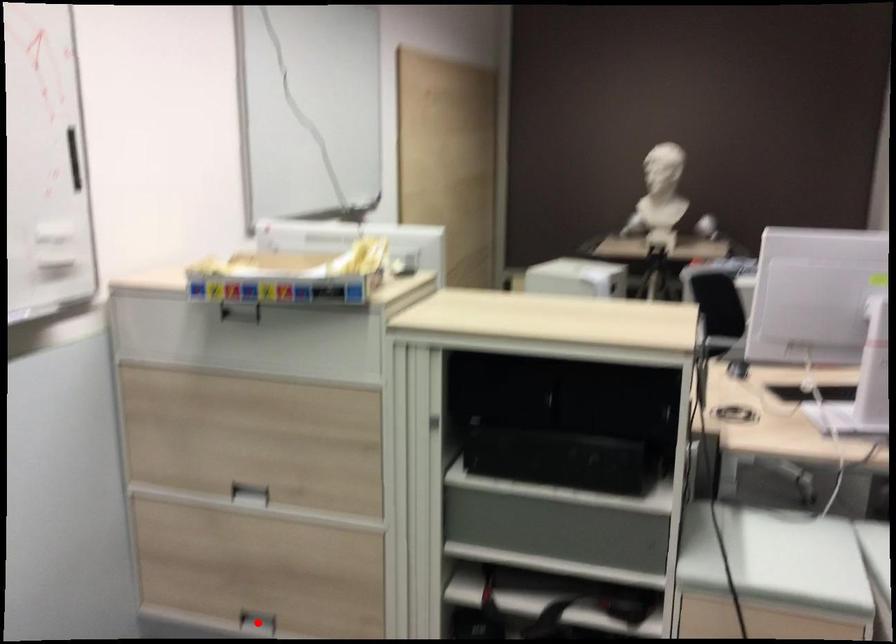
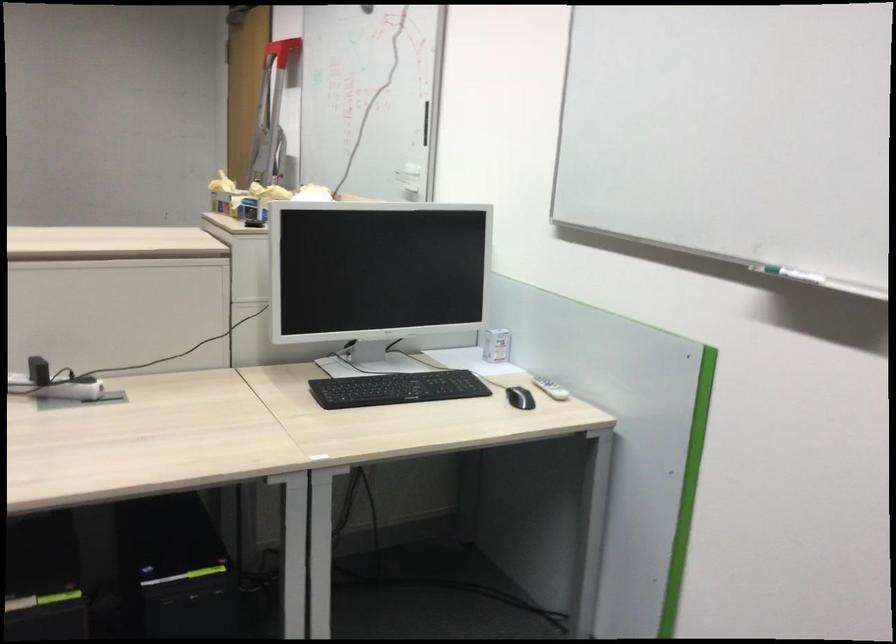
Question: I am providing you with two images of the same scene from different viewpoints. A red point is marked on the first image. Can you still see the location of the red point in image 2?

Choices:
 (A) Yes
 (B) No

Answer: (B)